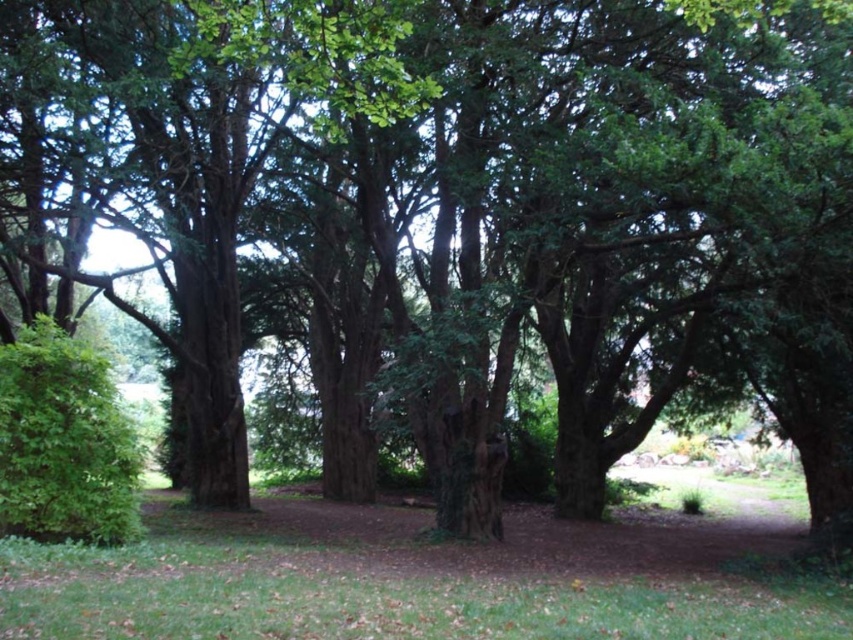
Is green grass at center behind green leafy hedge at lower left?

No, green grass at center is in front of green leafy hedge at lower left.

Does green grass at center have a larger size compared to green leafy hedge at lower left?

Correct, green grass at center is larger in size than green leafy hedge at lower left.

The image size is (853, 640). Describe the element at coordinates (376, 598) in the screenshot. I see `green grass at center` at that location.

The width and height of the screenshot is (853, 640). What are the coordinates of `green grass at center` in the screenshot? It's located at (376, 598).